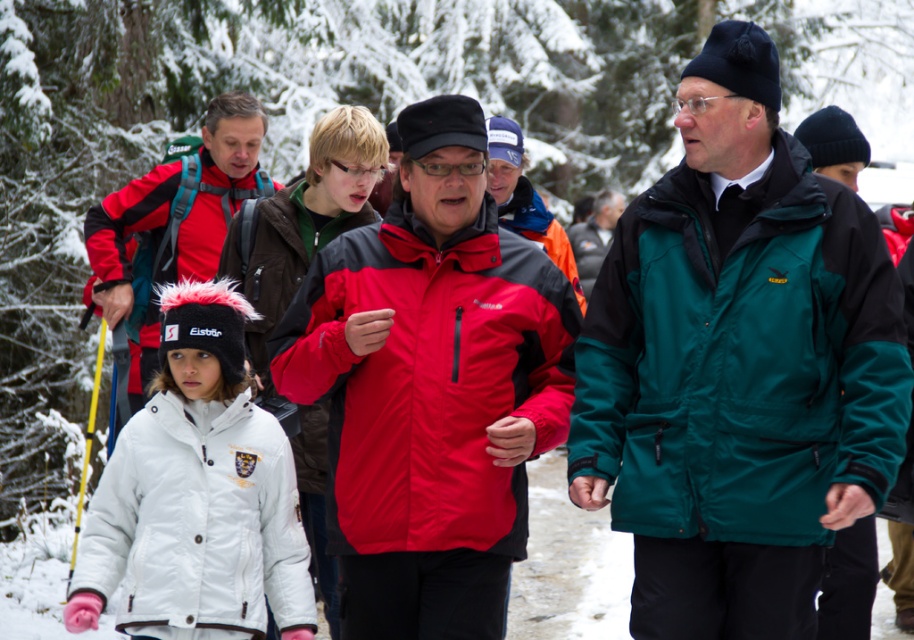
Between red matte jacket at center and white fleece jacket at center, which one has less height?

With less height is red matte jacket at center.

Which is behind, point (378, 259) or point (278, 246)?

Point (278, 246)

Which is in front, point (409, 461) or point (285, 280)?

Point (409, 461) is in front.

Locate an element on the screen. This screenshot has width=914, height=640. red matte jacket at center is located at coordinates (429, 380).

Is point (426, 317) behind point (166, 502)?

No.

Between point (454, 323) and point (264, 525), which one is positioned behind?

The point (264, 525) is behind.

Locate an element on the screen. The height and width of the screenshot is (640, 914). red matte jacket at center is located at coordinates (429, 380).

Locate an element on the screen. The width and height of the screenshot is (914, 640). red matte jacket at center is located at coordinates (429, 380).

Between matte red jacket at center and yellow plastic ski pole at left, which one has less height?

yellow plastic ski pole at left is shorter.

Which is above, matte red jacket at center or yellow plastic ski pole at left?

matte red jacket at center is higher up.

Does point (179, 186) come in front of point (78, 532)?

Yes, it is.

Identify the location of matte red jacket at center. (174, 224).